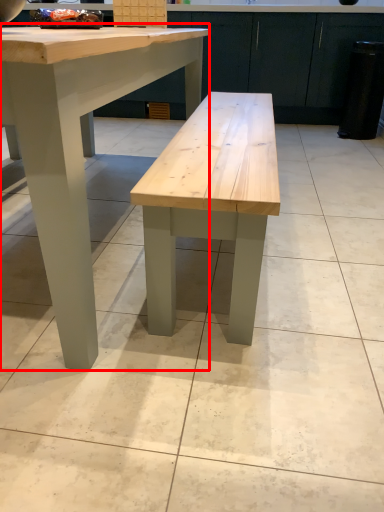
Question: Where is table (annotated by the red box) located in relation to cabinetry in the image?

Choices:
 (A) left
 (B) right

Answer: (A)